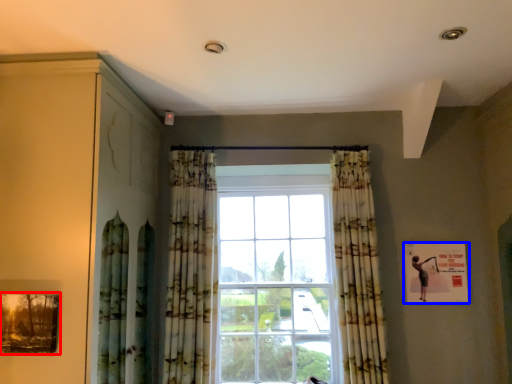
Question: Which of the following is the closest to the observer, picture frame (highlighted by a red box) or picture frame (highlighted by a blue box)?

Choices:
 (A) picture frame
 (B) picture frame

Answer: (A)